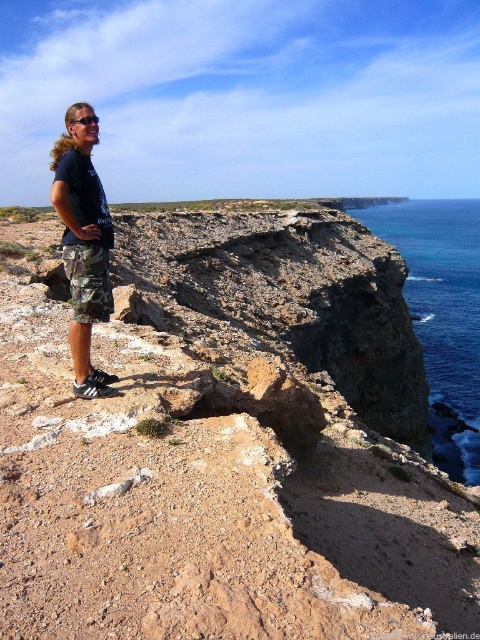
You are a photographer planning to capture the scene from the cliff. You want to ensure the blue liquid water at upper right and the camo shorts at center are both visible in your photo. Which object should you focus on to include both in the frame?

The blue liquid water at upper right is larger in size than the camo shorts at center, so focusing on the larger blue liquid water at upper right would help ensure both objects are visible in the frame.

Consider the image. You are a photographer planning to take a photo of the blue liquid water at upper right and the camo shorts at center. To ensure both are in focus, where should you position the camera focus point?

The blue liquid water at upper right is above the camo shorts at center, so positioning the focus point at the midpoint between them would ensure both are in focus.